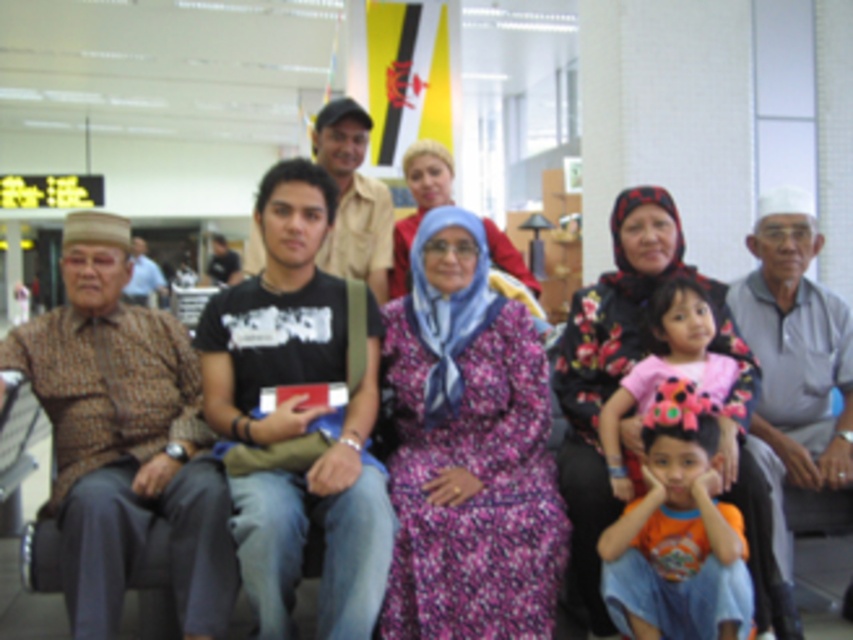
Looking at this image, who is positioned more to the left, floral-patterned dress at center or orange cotton shirt at lower right?

floral-patterned dress at center is more to the left.

Describe the element at coordinates (467, 451) in the screenshot. I see `floral-patterned dress at center` at that location.

This screenshot has width=853, height=640. Find the location of `floral-patterned dress at center`. floral-patterned dress at center is located at coordinates (467, 451).

Describe the element at coordinates (467, 451) in the screenshot. I see `floral-patterned dress at center` at that location.

Is point (508, 445) farther from viewer compared to point (579, 518)?

Yes.

Identify the location of floral-patterned dress at center. (467, 451).

Which of these two, orange cotton shirt at lower right or purple floral dress at center, stands shorter?

orange cotton shirt at lower right

Does orange cotton shirt at lower right have a smaller size compared to purple floral dress at center?

Yes.

Which is behind, point (660, 394) or point (496, 240)?

The point (496, 240) is more distant.

The image size is (853, 640). I want to click on orange cotton shirt at lower right, so click(677, 532).